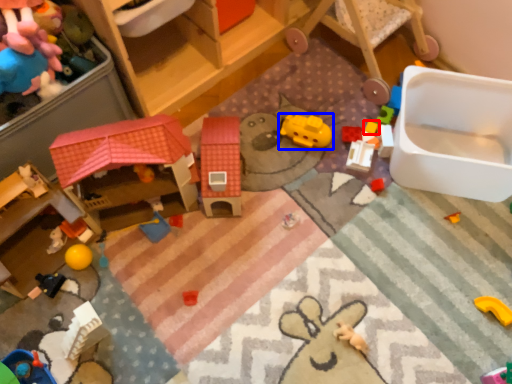
Question: Which of the following is the closest to the observer, toy (highlighted by a red box) or toy (highlighted by a blue box)?

Choices:
 (A) toy
 (B) toy

Answer: (B)